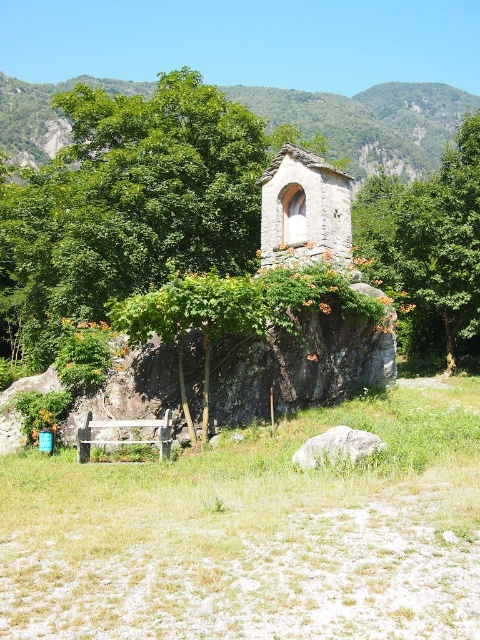
Does stone wall at center appear on the right side of white smooth rock at center?

Yes, stone wall at center is to the right of white smooth rock at center.

Who is more distant from viewer, (274, 248) or (327, 440)?

Positioned behind is point (274, 248).

Where is `stone wall at center`? The height and width of the screenshot is (640, 480). stone wall at center is located at coordinates (304, 209).

Between green leafy tree at center and stone wall at center, which one has more height?

Standing taller between the two is green leafy tree at center.

Can you confirm if green leafy tree at center is smaller than stone wall at center?

No, green leafy tree at center is not smaller than stone wall at center.

Is point (434, 241) farther from camera compared to point (274, 234)?

Yes, point (434, 241) is farther from viewer.

The width and height of the screenshot is (480, 640). What are the coordinates of `green leafy tree at center` in the screenshot? It's located at (428, 244).

Is green stone mountain at upper center positioned behind stone wall at center?

Yes.

Consider the image. Is green stone mountain at upper center taller than stone wall at center?

Yes.

Identify the location of green stone mountain at upper center. (369, 122).